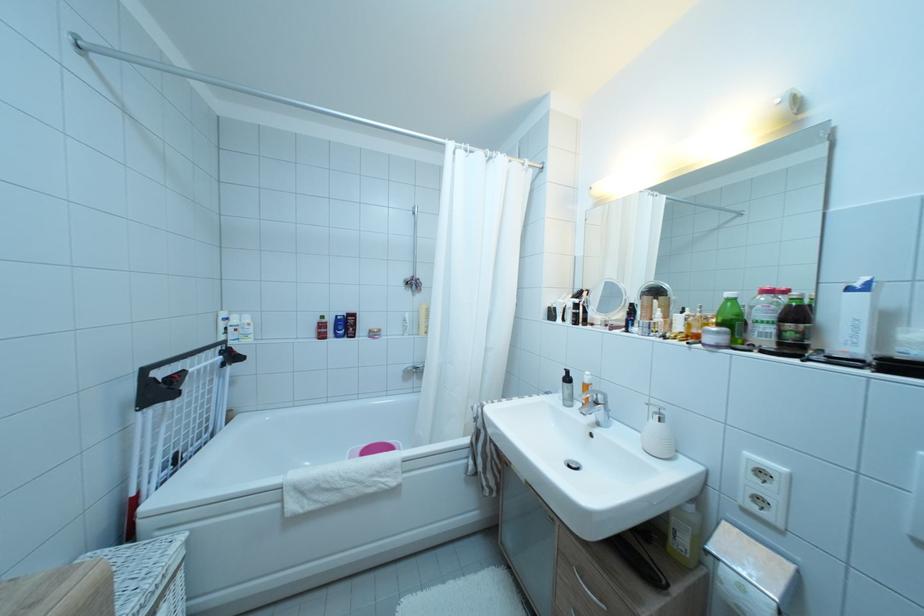
Image resolution: width=924 pixels, height=616 pixels. What do you see at coordinates (658, 438) in the screenshot?
I see `a toilet paper cover` at bounding box center [658, 438].